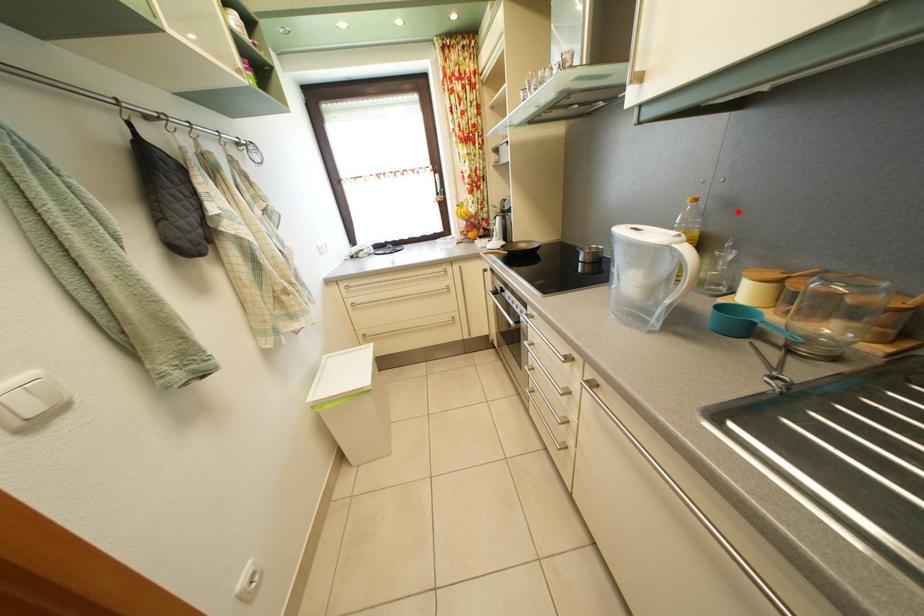
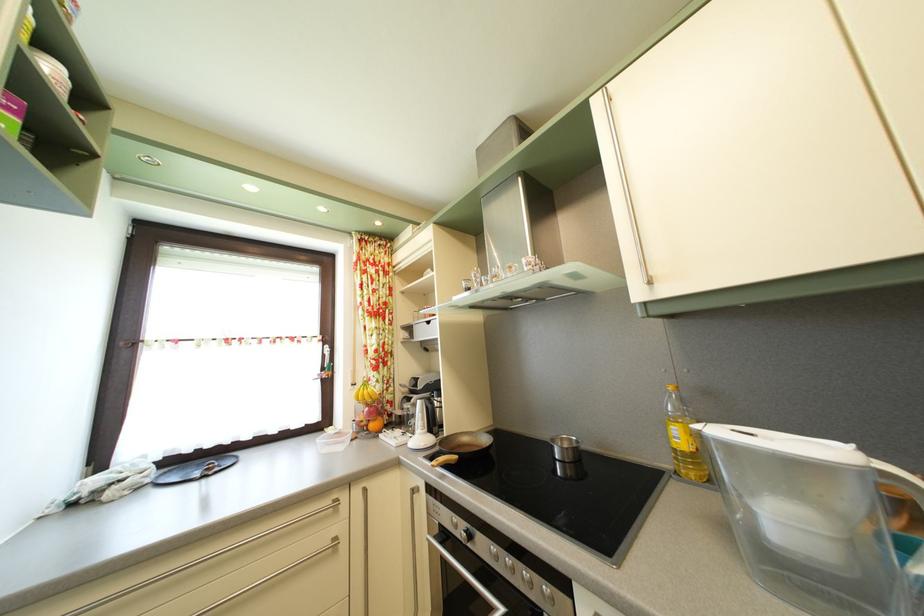
In the second image, find the point that corresponds to the highlighted location in the first image.

(715, 400)